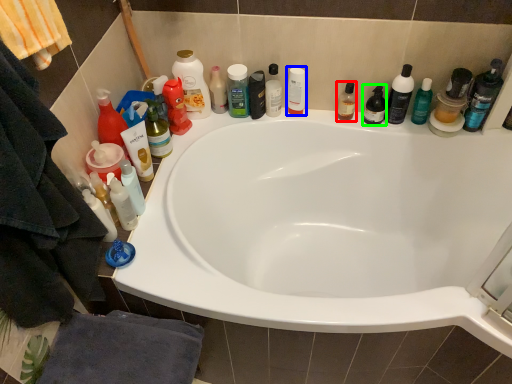
Question: Estimate the real-world distances between objects in this image. Which object is closer to mouthwash (highlighted by a red box), mouthwash (highlighted by a blue box) or toiletry (highlighted by a green box)?

Choices:
 (A) mouthwash
 (B) toiletry

Answer: (B)